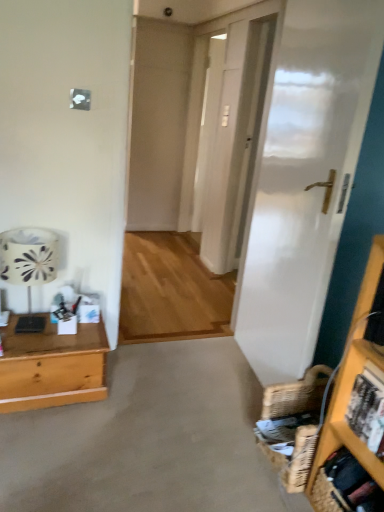
The height and width of the screenshot is (512, 384). What do you see at coordinates (28, 266) in the screenshot?
I see `white fabric lampshade at left` at bounding box center [28, 266].

What is the approximate width of beige carpet at lower center?

beige carpet at lower center is 1.26 meters in width.

Image resolution: width=384 pixels, height=512 pixels. Identify the location of woven brown basket at lower right. (293, 425).

This screenshot has width=384, height=512. I want to click on white fabric lampshade at left, so click(x=28, y=266).

Can you confirm if woven brown basket at lower right is smaller than transparent glass door at center?

Yes.

Is woven brown basket at lower right located outside transparent glass door at center?

woven brown basket at lower right is positioned outside transparent glass door at center.

From the image's perspective, does woven brown basket at lower right appear higher than transparent glass door at center?

No, from the image's perspective, woven brown basket at lower right is not over transparent glass door at center.

From a real-world perspective, relative to transparent glass door at center, is woven brown basket at lower right vertically above or below?

woven brown basket at lower right is situated lower than transparent glass door at center in the real world.

From a real-world perspective, which is physically above, transparent glass door at center or beige carpet at lower center?

In real-world perspective, transparent glass door at center is above.

Does transparent glass door at center have a lesser height compared to beige carpet at lower center?

Incorrect, the height of transparent glass door at center does not fall short of that of beige carpet at lower center.

Choose the correct answer: Is transparent glass door at center inside beige carpet at lower center or outside it?

transparent glass door at center cannot be found inside beige carpet at lower center.

In the scene shown: Are beige carpet at lower center and wooden desk at left making contact?

They are not placed beside each other.

From the picture: From a real-world perspective, is beige carpet at lower center beneath wooden desk at left?

Indeed, from a real-world perspective, beige carpet at lower center is positioned beneath wooden desk at left.

Is beige carpet at lower center outside of wooden desk at left?

Indeed, beige carpet at lower center is completely outside wooden desk at left.

Considering the relative sizes of beige carpet at lower center and wooden desk at left in the image provided, is beige carpet at lower center thinner than wooden desk at left?

In fact, beige carpet at lower center might be wider than wooden desk at left.

Can you confirm if beige carpet at lower center is shorter than woven brown basket at lower right?

Correct, beige carpet at lower center is not as tall as woven brown basket at lower right.

Between beige carpet at lower center and woven brown basket at lower right, which one appears on the left side from the viewer's perspective?

beige carpet at lower center.

Locate an element on the screen. basket behind the beige carpet at lower center is located at coordinates tap(293, 425).

From a real-world perspective, between beige carpet at lower center and woven brown basket at lower right, who is vertically higher?

woven brown basket at lower right, from a real-world perspective.

Does wooden desk at left have a smaller size compared to transparent glass door at center?

Yes, wooden desk at left is smaller than transparent glass door at center.

This screenshot has width=384, height=512. I want to click on desk in front of the transparent glass door at center, so click(x=52, y=366).

Which object is further away from the camera taking this photo, wooden desk at left or transparent glass door at center?

transparent glass door at center.

From a real-world perspective, is woven brown basket at lower right physically located above or below beige carpet at lower center?

woven brown basket at lower right is situated higher than beige carpet at lower center in the real world.

Does point (314, 395) come in front of point (190, 365)?

Yes, it is.

Is woven brown basket at lower right facing towards beige carpet at lower center?

No, woven brown basket at lower right is not turned towards beige carpet at lower center.

Can you tell me how much woven brown basket at lower right and beige carpet at lower center differ in facing direction?

They differ by 90.3 degrees in their facing directions.

From the image's perspective, which one is positioned lower, beige carpet at lower center or white fabric lampshade at left?

beige carpet at lower center is shown below in the image.

Could you tell me if beige carpet at lower center is turned towards white fabric lampshade at left?

No.

From a real-world perspective, does beige carpet at lower center sit lower than white fabric lampshade at left?

Yes.

Is beige carpet at lower center positioned far away from white fabric lampshade at left?

No.

Locate an element on the screen. basket below the transparent glass door at center (from the image's perspective) is located at coordinates coord(293,425).

At what (x,y) coordinates should I click in order to perform the action: click on glass door above the beige carpet at lower center (from the image's perspective). Please return your answer as a coordinate pair (x, y). Image resolution: width=384 pixels, height=512 pixels. Looking at the image, I should click on (226, 152).

When comparing their distances from beige carpet at lower center, does wooden desk at left or transparent glass door at center seem closer?

Based on the image, wooden desk at left appears to be nearer to beige carpet at lower center.

When comparing their distances from white fabric lampshade at left, does transparent glass door at center or beige carpet at lower center seem further?

Based on the image, transparent glass door at center appears to be further to white fabric lampshade at left.

Considering their positions, is beige carpet at lower center positioned closer to transparent glass door at center than white fabric lampshade at left?

white fabric lampshade at left lies closer to transparent glass door at center than the other object.

Considering their positions, is woven brown basket at lower right positioned further to white fabric lampshade at left than transparent glass door at center?

transparent glass door at center lies further to white fabric lampshade at left than the other object.

Estimate the real-world distances between objects in this image. Which object is further from woven brown basket at lower right, beige carpet at lower center or white fabric lampshade at left?

white fabric lampshade at left lies further to woven brown basket at lower right than the other object.

Estimate the real-world distances between objects in this image. Which object is further from woven brown basket at lower right, beige carpet at lower center or transparent glass door at center?

transparent glass door at center is positioned further to the anchor woven brown basket at lower right.

Estimate the real-world distances between objects in this image. Which object is further from woven brown basket at lower right, beige carpet at lower center or wooden desk at left?

wooden desk at left is positioned further to the anchor woven brown basket at lower right.

Estimate the real-world distances between objects in this image. Which object is closer to white fabric lampshade at left, beige carpet at lower center or woven brown basket at lower right?

beige carpet at lower center is closer to white fabric lampshade at left.

Image resolution: width=384 pixels, height=512 pixels. Identify the location of concrete situated between white fabric lampshade at left and woven brown basket at lower right from left to right. (148, 439).

Where is `concrete between wooden desk at left and woven brown basket at lower right in the horizontal direction`? The width and height of the screenshot is (384, 512). concrete between wooden desk at left and woven brown basket at lower right in the horizontal direction is located at coordinates (148, 439).

Find the location of a particular element. The width and height of the screenshot is (384, 512). basket positioned between beige carpet at lower center and transparent glass door at center from near to far is located at coordinates (293, 425).

Locate an element on the screen. The image size is (384, 512). desk between white fabric lampshade at left and transparent glass door at center from front to back is located at coordinates (52, 366).